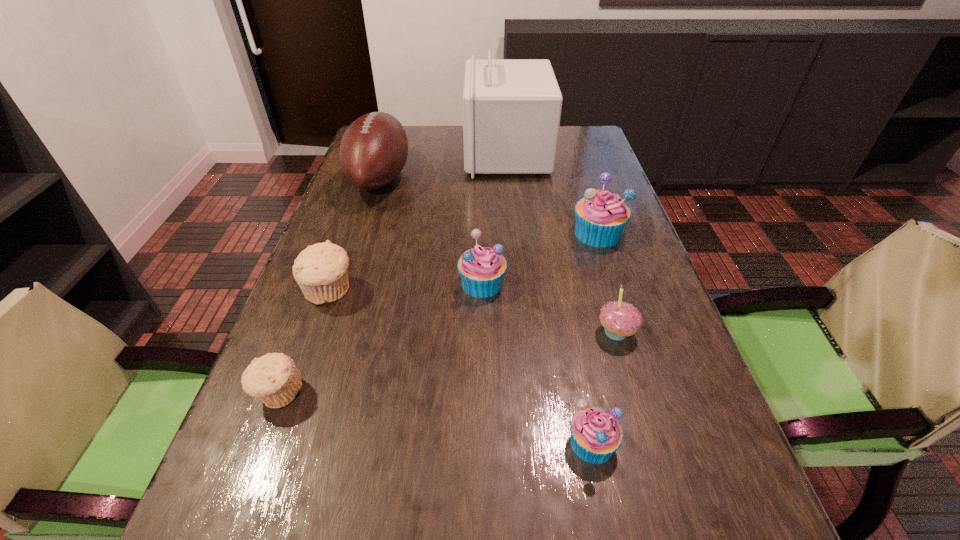
The width and height of the screenshot is (960, 540). I want to click on free point between the third muffin from left to right and the brown football (American), so click(431, 231).

This screenshot has height=540, width=960. What are the coordinates of `free area in between the farther beige muffin and the second biggest blue muffin` in the screenshot? It's located at (405, 287).

The height and width of the screenshot is (540, 960). In order to click on vacant space in between the second tallest object and the biggest blue muffin in this screenshot , I will do `click(489, 206)`.

Where is `free space between the second blue muffin from left to right and the farther beige muffin`? The height and width of the screenshot is (540, 960). free space between the second blue muffin from left to right and the farther beige muffin is located at coordinates (460, 367).

Locate an element on the screen. object that can be found as the fifth closest to the farther beige muffin is located at coordinates (596, 434).

Identify the location of object that is the nearest to the tallest object. This screenshot has height=540, width=960. (374, 148).

Identify which muffin is the nearest to the tallest object. Please provide its 2D coordinates. Your answer should be formatted as a tuple, i.e. [(x, y)], where the tuple contains the x and y coordinates of a point satisfying the conditions above.

[(601, 216)]

Locate which muffin is the second closest to the second farthest blue muffin. Please provide its 2D coordinates. Your answer should be formatted as a tuple, i.e. [(x, y)], where the tuple contains the x and y coordinates of a point satisfying the conditions above.

[(320, 270)]

Identify the location of blue muffin identified as the closest to the bigger beige muffin. (482, 269).

Select which blue muffin is the second closest to the second smallest blue muffin. Please provide its 2D coordinates. Your answer should be formatted as a tuple, i.e. [(x, y)], where the tuple contains the x and y coordinates of a point satisfying the conditions above.

[(596, 434)]